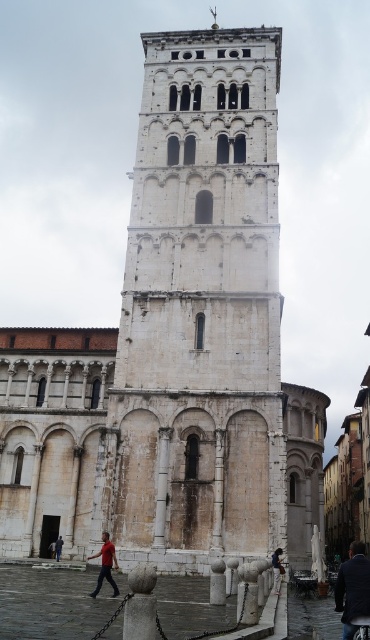
You are standing in front of the historic Romanesque building and want to locate two specific points marked on the structure. The first point is at coordinates point (277, 444) and the second is at point (347, 624). Which of these points is closer to you?

Point (277, 444) is closer to you because it is further to the viewer than point (347, 624).

You are standing in front of the historic Romanesque structure and notice a red cotton shirt at lower left. Where exactly is the red cotton shirt positioned relative to the main building?

The red cotton shirt at lower left is located at point (105, 564), which places it near the lower left corner of the scene, slightly to the right of the main building.